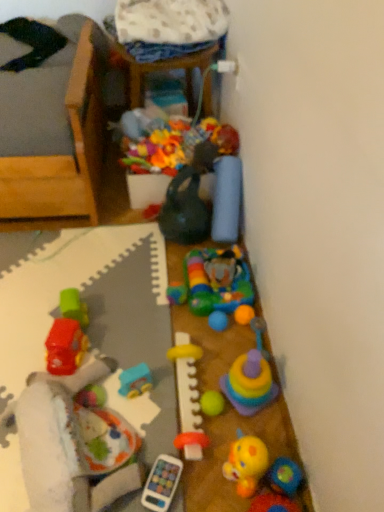
Find the location of `free space between yellow rubber teething ring at center, positioned as the eighth toy in right-to-left order, and blue plastic toy car at center, which is the second toy from left to right`. free space between yellow rubber teething ring at center, positioned as the eighth toy in right-to-left order, and blue plastic toy car at center, which is the second toy from left to right is located at coordinates (157, 400).